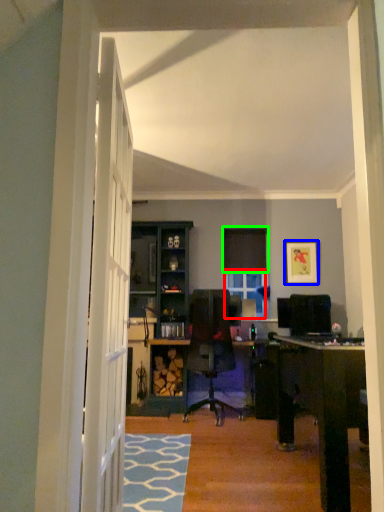
Question: Which object is the closest to the window (highlighted by a red box)? Choose among these: picture frame (highlighted by a blue box) or curtain (highlighted by a green box).

Choices:
 (A) picture frame
 (B) curtain

Answer: (B)